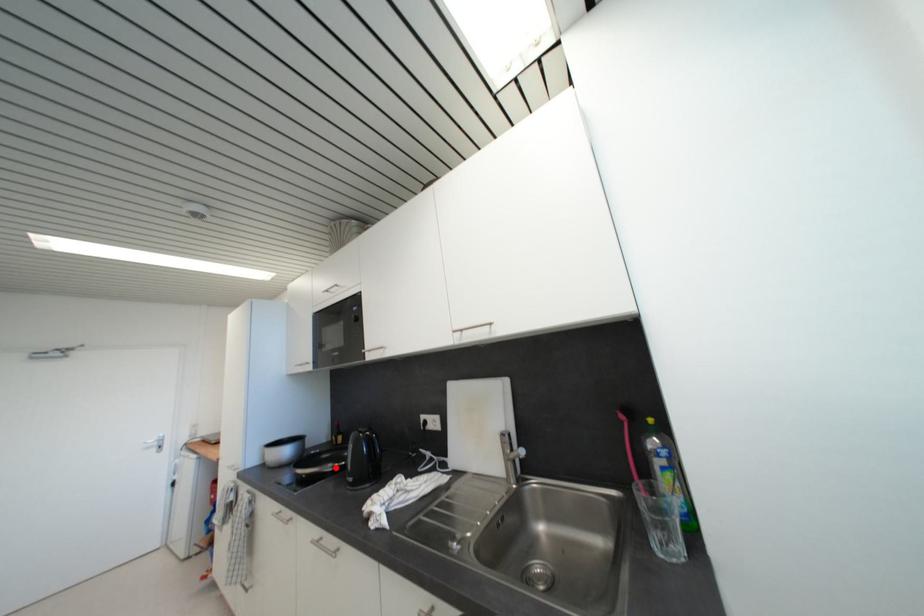
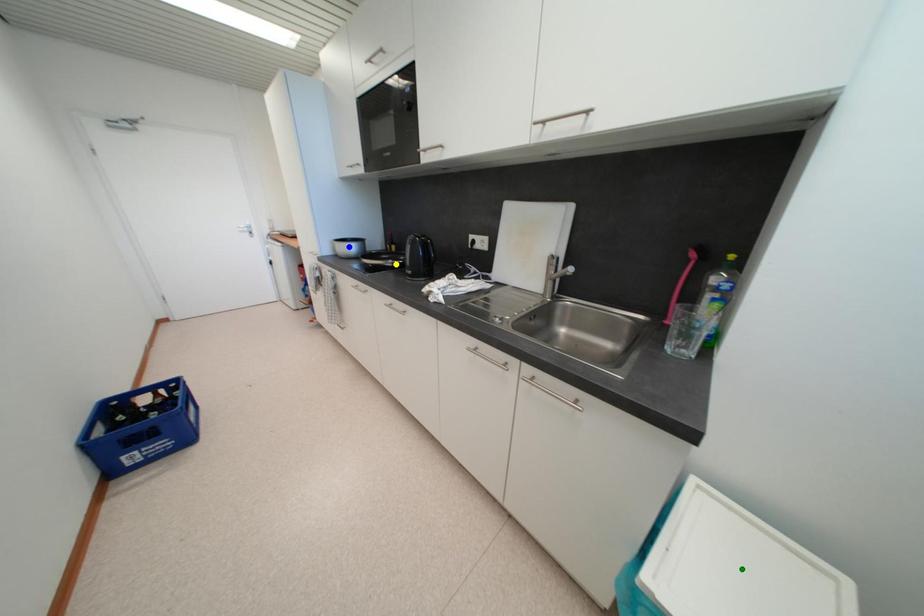
Question: I am providing you with two images of the same scene from different viewpoints. A red point is marked on the first image. You are given multiple points on the second image. Which point in image 2 is actually the same real-world point as the red point in image 1?

Choices:
 (A) blue point
 (B) yellow point
 (C) green point

Answer: (B)